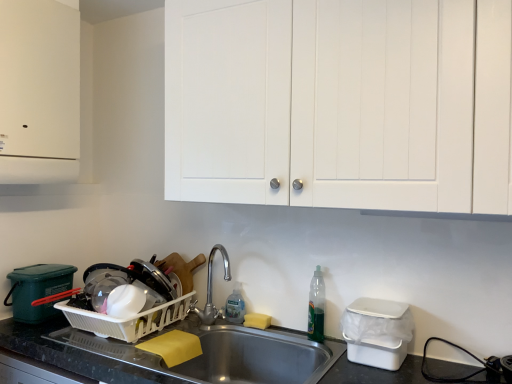
Where is `clear plastic bottle at sink, the 2th bottle positioned from the right`? The image size is (512, 384). clear plastic bottle at sink, the 2th bottle positioned from the right is located at coordinates (234, 305).

How much space does white matte cabinet at upper left, acting as the 2th cabinetry starting from the right, occupy horizontally?

12.23 inches.

What do you see at coordinates (377, 332) in the screenshot? The height and width of the screenshot is (384, 512). I see `white plastic container at lower right, positioned as the first appliance in front-to-back order` at bounding box center [377, 332].

What is the approximate width of white plastic container at lower right, which is the first appliance in right-to-left order?

The width of white plastic container at lower right, which is the first appliance in right-to-left order, is 9.60 inches.

How much space does white matte cabinet doors at upper center, arranged as the 1th cabinetry when viewed from the right, occupy vertically?

It is 74.89 centimeters.

I want to click on translucent plastic bottle at sink right, the second bottle in the left-to-right sequence, so click(316, 307).

From the image's perspective, count 1st cabinetrys upward from the translucent plastic bottle at sink right, arranged as the second bottle when viewed from the back, and point to it. Please provide its 2D coordinates.

[(340, 103)]

Is point (318, 299) closer or farther from the camera than point (301, 39)?

Point (318, 299) is farther from the camera than point (301, 39).

Looking at this image, is translucent plastic bottle at sink right, acting as the first bottle starting from the front, far from white matte cabinet doors at upper center, arranged as the 1th cabinetry when viewed from the right?

translucent plastic bottle at sink right, acting as the first bottle starting from the front, is near white matte cabinet doors at upper center, arranged as the 1th cabinetry when viewed from the right, not far away.

Between translucent plastic bottle at sink right, arranged as the second bottle when viewed from the back, and white matte cabinet doors at upper center, which is the 2th cabinetry in left-to-right order, which one has smaller width?

Thinner between the two is translucent plastic bottle at sink right, arranged as the second bottle when viewed from the back.

Is clear plastic bottle at sink, positioned as the 1th bottle in left-to-right order, facing towards white plastic dish rack at lower left, marked as the 2th appliance in a front-to-back arrangement?

No, clear plastic bottle at sink, positioned as the 1th bottle in left-to-right order, does not turn towards white plastic dish rack at lower left, marked as the 2th appliance in a front-to-back arrangement.

Between clear plastic bottle at sink, the second bottle viewed from the front, and white plastic dish rack at lower left, the 2th appliance when ordered from right to left, which one has larger size?

white plastic dish rack at lower left, the 2th appliance when ordered from right to left.

Is clear plastic bottle at sink, the second bottle viewed from the front, positioned beyond the bounds of white plastic dish rack at lower left, marked as the 2th appliance in a front-to-back arrangement?

Yes, clear plastic bottle at sink, the second bottle viewed from the front, is outside of white plastic dish rack at lower left, marked as the 2th appliance in a front-to-back arrangement.

Is clear plastic bottle at sink, the 2th bottle positioned from the right, taller or shorter than white plastic dish rack at lower left, positioned as the first appliance in back-to-front order?

Clearly, clear plastic bottle at sink, the 2th bottle positioned from the right, is taller compared to white plastic dish rack at lower left, positioned as the first appliance in back-to-front order.

At what (x,y) coordinates should I click in order to perform the action: click on bottle in front of the yellow sponge at sink. Please return your answer as a coordinate pair (x, y). Image resolution: width=512 pixels, height=384 pixels. Looking at the image, I should click on (316, 307).

Considering the relative positions of yellow sponge at sink and translucent plastic bottle at sink right, arranged as the second bottle when viewed from the back, in the image provided, is yellow sponge at sink to the right of translucent plastic bottle at sink right, arranged as the second bottle when viewed from the back, from the viewer's perspective?

Incorrect, yellow sponge at sink is not on the right side of translucent plastic bottle at sink right, arranged as the second bottle when viewed from the back.

Which of these two, yellow sponge at sink or translucent plastic bottle at sink right, which is counted as the 1th bottle, starting from the right, stands taller?

translucent plastic bottle at sink right, which is counted as the 1th bottle, starting from the right.

Is point (354, 348) closer or farther from the camera than point (55, 71)?

Clearly, point (354, 348) is closer to the camera than point (55, 71).

From a real-world perspective, who is located lower, white plastic container at lower right, which is the first appliance in right-to-left order, or white matte cabinet at upper left, acting as the 2th cabinetry starting from the right?

In real-world perspective, white plastic container at lower right, which is the first appliance in right-to-left order, is lower.

Could you tell me if white plastic container at lower right, the second appliance in the left-to-right sequence, is turned towards white matte cabinet at upper left, the 1th cabinetry positioned from the left?

No, white plastic container at lower right, the second appliance in the left-to-right sequence, does not turn towards white matte cabinet at upper left, the 1th cabinetry positioned from the left.

From the image's perspective, is white plastic dish rack at lower left, the first appliance positioned from the left, above white matte cabinet doors at upper center, arranged as the 1th cabinetry when viewed from the right?

Incorrect, from the image's perspective, white plastic dish rack at lower left, the first appliance positioned from the left, is lower than white matte cabinet doors at upper center, arranged as the 1th cabinetry when viewed from the right.

Is white plastic dish rack at lower left, marked as the 2th appliance in a front-to-back arrangement, inside the boundaries of white matte cabinet doors at upper center, which is the 2th cabinetry in left-to-right order, or outside?

white plastic dish rack at lower left, marked as the 2th appliance in a front-to-back arrangement, lies outside white matte cabinet doors at upper center, which is the 2th cabinetry in left-to-right order.

Is white plastic dish rack at lower left, positioned as the first appliance in back-to-front order, not near white matte cabinet doors at upper center, arranged as the 1th cabinetry when viewed from the right?

No, white plastic dish rack at lower left, positioned as the first appliance in back-to-front order, is not far away from white matte cabinet doors at upper center, arranged as the 1th cabinetry when viewed from the right.

Between white plastic dish rack at lower left, the first appliance positioned from the left, and white matte cabinet doors at upper center, arranged as the 1th cabinetry when viewed from the right, which one has larger size?

Bigger between the two is white matte cabinet doors at upper center, arranged as the 1th cabinetry when viewed from the right.

Measure the distance from white matte cabinet doors at upper center, arranged as the 1th cabinetry when viewed from the right, to translucent plastic bottle at sink right, acting as the first bottle starting from the front.

They are 27.58 inches apart.

From the image's perspective, which is below, white matte cabinet doors at upper center, which is the 2th cabinetry in left-to-right order, or translucent plastic bottle at sink right, which is counted as the 1th bottle, starting from the right?

From the image's view, translucent plastic bottle at sink right, which is counted as the 1th bottle, starting from the right, is below.

In terms of size, does white matte cabinet doors at upper center, arranged as the 1th cabinetry when viewed from the right, appear bigger or smaller than translucent plastic bottle at sink right, acting as the first bottle starting from the front?

In the image, white matte cabinet doors at upper center, arranged as the 1th cabinetry when viewed from the right, appears to be larger than translucent plastic bottle at sink right, acting as the first bottle starting from the front.

Can you confirm if white matte cabinet doors at upper center, which is the 2th cabinetry in left-to-right order, is shorter than translucent plastic bottle at sink right, which is counted as the 1th bottle, starting from the right?

No, white matte cabinet doors at upper center, which is the 2th cabinetry in left-to-right order, is not shorter than translucent plastic bottle at sink right, which is counted as the 1th bottle, starting from the right.

Is white matte cabinet at upper left, acting as the 2th cabinetry starting from the right, far from white plastic dish rack at lower left, positioned as the first appliance in back-to-front order?

No, white matte cabinet at upper left, acting as the 2th cabinetry starting from the right, is not far away from white plastic dish rack at lower left, positioned as the first appliance in back-to-front order.

How distant is white matte cabinet at upper left, the 1th cabinetry positioned from the left, from white plastic dish rack at lower left, marked as the 2th appliance in a front-to-back arrangement?

white matte cabinet at upper left, the 1th cabinetry positioned from the left, is 26.63 inches away from white plastic dish rack at lower left, marked as the 2th appliance in a front-to-back arrangement.

Which object is positioned more to the right, white matte cabinet at upper left, the 1th cabinetry positioned from the left, or white plastic dish rack at lower left, marked as the 2th appliance in a front-to-back arrangement?

From the viewer's perspective, white plastic dish rack at lower left, marked as the 2th appliance in a front-to-back arrangement, appears more on the right side.

Is white matte cabinet at upper left, the 1th cabinetry positioned from the left, facing towards white plastic dish rack at lower left, positioned as the first appliance in back-to-front order?

No.

From the image's perspective, which cabinetry is the 1st one above the translucent plastic bottle at sink right, the second bottle in the left-to-right sequence? Please provide its 2D coordinates.

[(340, 103)]

Find the location of a particular element. the 1st bottle located above the white plastic dish rack at lower left, the 2th appliance when ordered from right to left (from a real-world perspective) is located at coordinates (234, 305).

Estimate the real-world distances between objects in this image. Which object is further from yellow sponge at sink, translucent plastic bottle at sink right, arranged as the second bottle when viewed from the back, or white matte cabinet at upper left, acting as the 2th cabinetry starting from the right?

white matte cabinet at upper left, acting as the 2th cabinetry starting from the right, is positioned further to the anchor yellow sponge at sink.

From the picture: Considering their positions, is yellow sponge at sink positioned closer to white matte cabinet at upper left, the 1th cabinetry positioned from the left, than white plastic container at lower right, the second appliance in the left-to-right sequence?

yellow sponge at sink lies closer to white matte cabinet at upper left, the 1th cabinetry positioned from the left, than the other object.

Estimate the real-world distances between objects in this image. Which object is further from stainless steel sink at lower center, white matte cabinet at upper left, the 1th cabinetry positioned from the left, or translucent plastic bottle at sink right, the second bottle in the left-to-right sequence?

Among the two, white matte cabinet at upper left, the 1th cabinetry positioned from the left, is located further to stainless steel sink at lower center.

Considering their positions, is white plastic dish rack at lower left, positioned as the first appliance in back-to-front order, positioned further to white plastic container at lower right, which is the first appliance in right-to-left order, than white matte cabinet doors at upper center, which is the 2th cabinetry in left-to-right order?

Among the two, white plastic dish rack at lower left, positioned as the first appliance in back-to-front order, is located further to white plastic container at lower right, which is the first appliance in right-to-left order.

Looking at the image, which one is located further to white matte cabinet at upper left, acting as the 2th cabinetry starting from the right, translucent plastic bottle at sink right, the second bottle in the left-to-right sequence, or stainless steel sink at lower center?

translucent plastic bottle at sink right, the second bottle in the left-to-right sequence, lies further to white matte cabinet at upper left, acting as the 2th cabinetry starting from the right, than the other object.

Estimate the real-world distances between objects in this image. Which object is further from yellow sponge at sink, translucent plastic bottle at sink right, which is counted as the 1th bottle, starting from the right, or clear plastic bottle at sink, positioned as the 1th bottle in left-to-right order?

translucent plastic bottle at sink right, which is counted as the 1th bottle, starting from the right, is positioned further to the anchor yellow sponge at sink.

Looking at this image, estimate the real-world distances between objects in this image. Which object is closer to white matte cabinet at upper left, acting as the 2th cabinetry starting from the right, yellow sponge at sink or white matte cabinet doors at upper center, which is the 2th cabinetry in left-to-right order?

white matte cabinet doors at upper center, which is the 2th cabinetry in left-to-right order, is closer to white matte cabinet at upper left, acting as the 2th cabinetry starting from the right.

Considering their positions, is white plastic container at lower right, which is the first appliance in right-to-left order, positioned closer to white plastic dish rack at lower left, marked as the 2th appliance in a front-to-back arrangement, than white matte cabinet doors at upper center, which is the 2th cabinetry in left-to-right order?

Among the two, white matte cabinet doors at upper center, which is the 2th cabinetry in left-to-right order, is located nearer to white plastic dish rack at lower left, marked as the 2th appliance in a front-to-back arrangement.

In order to click on cabinetry between white plastic dish rack at lower left, marked as the 2th appliance in a front-to-back arrangement, and white plastic container at lower right, positioned as the first appliance in front-to-back order, from left to right in this screenshot , I will do `click(340, 103)`.

I want to click on soap between white matte cabinet at upper left, the 1th cabinetry positioned from the left, and white matte cabinet doors at upper center, which is the 2th cabinetry in left-to-right order, in the horizontal direction, so click(x=257, y=320).

The width and height of the screenshot is (512, 384). Identify the location of soap between white matte cabinet doors at upper center, which is the 2th cabinetry in left-to-right order, and stainless steel sink at lower center in the up-down direction. (257, 320).

You are a GUI agent. You are given a task and a screenshot of the screen. Output one action in this format:
    pyautogui.click(x=<x>, y=<y>)
    Task: Click on the sink located between white plastic dish rack at lower left, the 2th appliance when ordered from right to left, and translucent plastic bottle at sink right, acting as the first bottle starting from the front, in the left-right direction
    Image resolution: width=512 pixels, height=384 pixels.
    Given the screenshot: What is the action you would take?
    pyautogui.click(x=258, y=357)